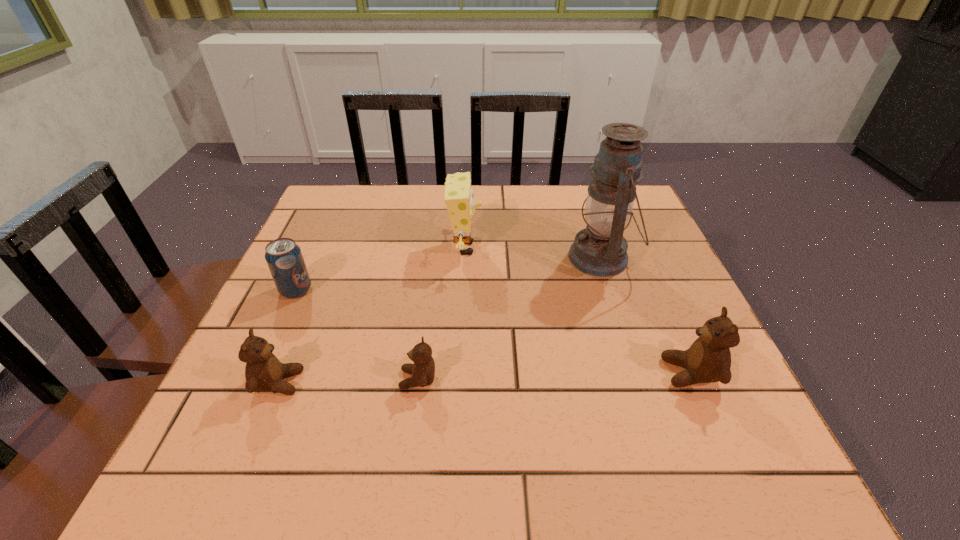
Locate an element on the screen. The image size is (960, 540). teddy bear that is at the left edge is located at coordinates (264, 372).

Find the location of a particular element. The image size is (960, 540). pop soda that is at the left edge is located at coordinates (284, 258).

Identify the location of teddy bear that is at the right edge. The width and height of the screenshot is (960, 540). (708, 359).

This screenshot has width=960, height=540. I want to click on oil lamp situated at the right edge, so click(601, 250).

This screenshot has width=960, height=540. In order to click on object that is at the near left corner in this screenshot , I will do `click(264, 372)`.

I want to click on object positioned at the near right corner, so click(x=708, y=359).

I want to click on vacant space at the far edge of the desktop, so click(554, 199).

The image size is (960, 540). In the image, there is a desktop. What are the coordinates of `vacant space at the near edge` in the screenshot? It's located at (463, 385).

In the image, there is a desktop. At what (x,y) coordinates should I click in order to perform the action: click on free space at the left edge. Please return your answer as a coordinate pair (x, y). Image resolution: width=960 pixels, height=540 pixels. Looking at the image, I should click on (345, 251).

Locate an element on the screen. This screenshot has width=960, height=540. blank area at the right edge is located at coordinates (641, 329).